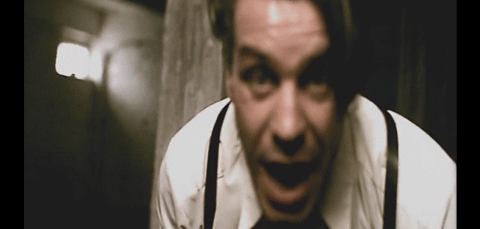
At what (x,y) coordinates should I click in order to perform the action: click on window. Please return your answer as a coordinate pair (x, y). Image resolution: width=480 pixels, height=229 pixels. Looking at the image, I should click on (71, 62).